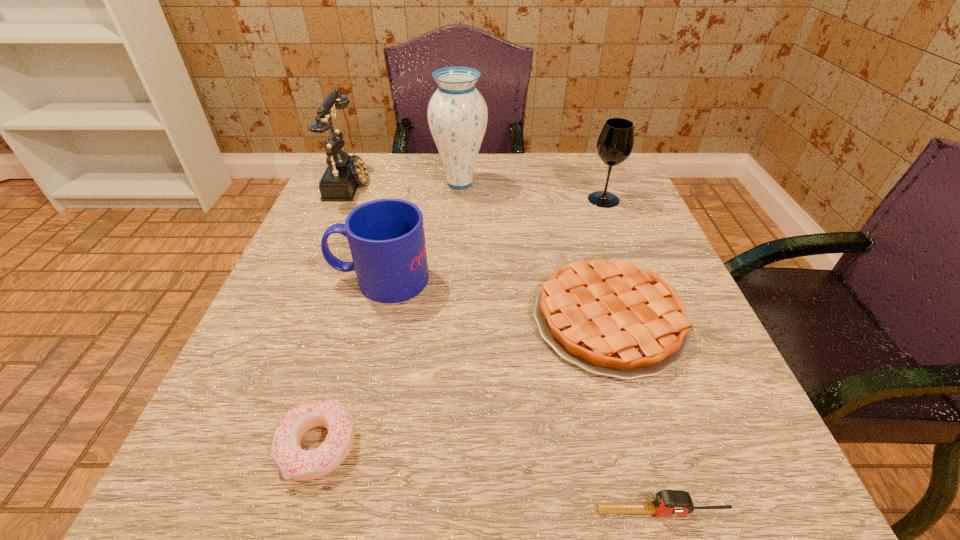
Locate an element on the screen. The image size is (960, 540). vacant space at the near edge of the desktop is located at coordinates [594, 453].

In order to click on vacant space at the left edge of the desktop in this screenshot , I will do `click(311, 287)`.

Locate an element on the screen. This screenshot has width=960, height=540. free space at the right edge is located at coordinates (678, 284).

The width and height of the screenshot is (960, 540). In the image, there is a desktop. Find the location of `free region at the far left corner`. free region at the far left corner is located at coordinates (396, 154).

Where is `vacant space at the near left corner of the desktop`? This screenshot has width=960, height=540. vacant space at the near left corner of the desktop is located at coordinates (263, 507).

I want to click on vacant space at the far right corner of the desktop, so pyautogui.click(x=560, y=157).

Where is `free space that is in between the mug and the wineglass`? This screenshot has width=960, height=540. free space that is in between the mug and the wineglass is located at coordinates (492, 239).

Where is `free point between the vase and the pie`? The height and width of the screenshot is (540, 960). free point between the vase and the pie is located at coordinates (535, 252).

Locate an element on the screen. The width and height of the screenshot is (960, 540). free space between the telephone and the vase is located at coordinates (405, 183).

Locate an element on the screen. free space between the telephone and the sixth farthest object is located at coordinates (334, 314).